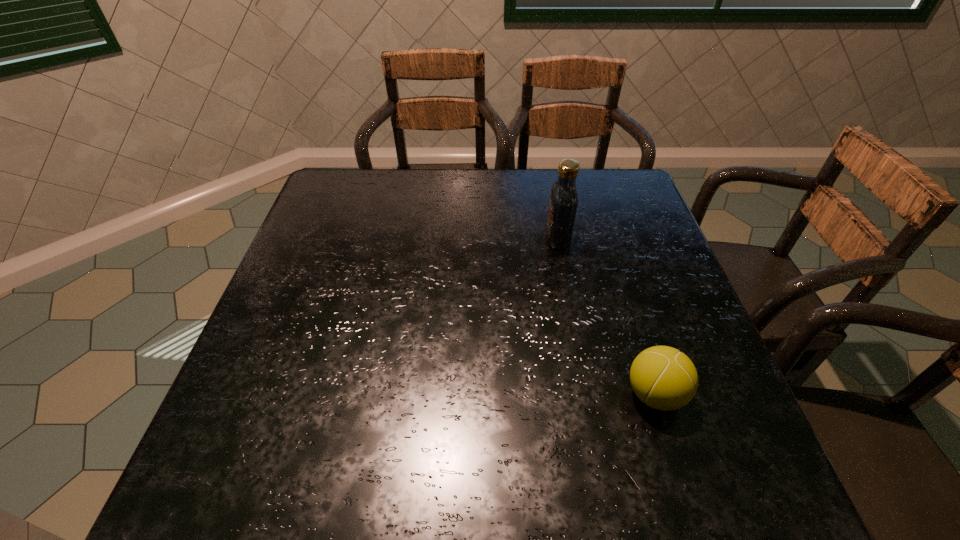
Find the location of a particular element. The height and width of the screenshot is (540, 960). free space that satisfies the following two spatial constraints: 1. on the front-facing side of the shorter object; 2. on the left side of the farther object is located at coordinates (588, 394).